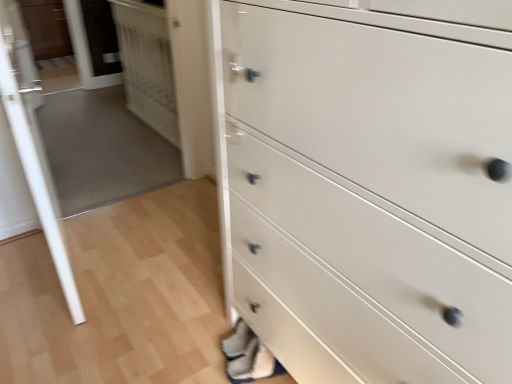
Describe the element at coordinates (104, 101) in the screenshot. I see `transparent glass door at upper left, the 1th glass door from the back` at that location.

This screenshot has height=384, width=512. I want to click on transparent glass door at left, which appears as the 2th glass door when viewed from the back, so click(32, 141).

What do you see at coordinates (147, 65) in the screenshot? The height and width of the screenshot is (384, 512). I see `white glossy door at upper left` at bounding box center [147, 65].

This screenshot has height=384, width=512. Find the location of `transparent glass door at upper left, positioned as the 2th glass door in front-to-back order`. transparent glass door at upper left, positioned as the 2th glass door in front-to-back order is located at coordinates (104, 101).

Between point (6, 44) and point (56, 49), which one is positioned in front?

Positioned in front is point (6, 44).

Consider the image. From a real-world perspective, does transparent glass door at left, which appears as the 2th glass door when viewed from the back, sit lower than matte brown cabinet at upper left?

No.

Considering the positions of objects transparent glass door at left, the first glass door viewed from the front, and matte brown cabinet at upper left in the image provided, who is behind, transparent glass door at left, the first glass door viewed from the front, or matte brown cabinet at upper left?

matte brown cabinet at upper left.

Are transparent glass door at left, which appears as the 2th glass door when viewed from the back, and matte brown cabinet at upper left making contact?

No, transparent glass door at left, which appears as the 2th glass door when viewed from the back, is not with matte brown cabinet at upper left.

From a real-world perspective, is white glossy chest of drawers at lower right on top of matte brown cabinet at upper left?

Yes, from a real-world perspective, white glossy chest of drawers at lower right is over matte brown cabinet at upper left

Can you tell me how much white glossy chest of drawers at lower right and matte brown cabinet at upper left differ in facing direction?

90.5 degrees.

Considering the relative sizes of white glossy chest of drawers at lower right and matte brown cabinet at upper left in the image provided, is white glossy chest of drawers at lower right smaller than matte brown cabinet at upper left?

No.

Considering the sizes of objects white glossy chest of drawers at lower right and matte brown cabinet at upper left in the image provided, who is shorter, white glossy chest of drawers at lower right or matte brown cabinet at upper left?

matte brown cabinet at upper left is shorter.

From the image's perspective, between matte brown cabinet at upper left and white glossy door at upper left, who is located below?

white glossy door at upper left appears lower in the image.

Between matte brown cabinet at upper left and white glossy door at upper left, which one appears on the left side from the viewer's perspective?

matte brown cabinet at upper left.

Is white glossy door at upper left inside matte brown cabinet at upper left?

No, white glossy door at upper left is not a part of matte brown cabinet at upper left.

Is transparent glass door at upper left, the 1th glass door from the back, next to transparent glass door at left, the first glass door viewed from the front, and touching it?

No, transparent glass door at upper left, the 1th glass door from the back, is not beside transparent glass door at left, the first glass door viewed from the front.

Is transparent glass door at upper left, the 1th glass door from the back, positioned in front of transparent glass door at left, the first glass door viewed from the front?

No, transparent glass door at upper left, the 1th glass door from the back, is further to the viewer.

Considering the sizes of transparent glass door at upper left, the 1th glass door from the back, and transparent glass door at left, the first glass door viewed from the front, in the image, is transparent glass door at upper left, the 1th glass door from the back, wider or thinner than transparent glass door at left, the first glass door viewed from the front,?

Considering their sizes, transparent glass door at upper left, the 1th glass door from the back, looks slimmer than transparent glass door at left, the first glass door viewed from the front.

Who is taller, transparent glass door at upper left, the 1th glass door from the back, or transparent glass door at left, which appears as the 2th glass door when viewed from the back?

transparent glass door at left, which appears as the 2th glass door when viewed from the back, is taller.

Consider the image. How much distance is there between white glossy door at upper left and white glossy chest of drawers at lower right?

A distance of 2.02 meters exists between white glossy door at upper left and white glossy chest of drawers at lower right.

Is white glossy door at upper left touching white glossy chest of drawers at lower right?

No, white glossy door at upper left is not beside white glossy chest of drawers at lower right.

From a real-world perspective, is white glossy door at upper left beneath white glossy chest of drawers at lower right?

Yes, from a real-world perspective, white glossy door at upper left is below white glossy chest of drawers at lower right.

What's the angular difference between white glossy door at upper left and white glossy chest of drawers at lower right's facing directions?

There is a 0.478-degree angle between the facing directions of white glossy door at upper left and white glossy chest of drawers at lower right.

Between transparent glass door at left, the first glass door viewed from the front, and white glossy door at upper left, which one is positioned in front?

Positioned in front is transparent glass door at left, the first glass door viewed from the front.

Is transparent glass door at left, which appears as the 2th glass door when viewed from the back, taller than white glossy door at upper left?

Indeed, transparent glass door at left, which appears as the 2th glass door when viewed from the back, has a greater height compared to white glossy door at upper left.

How many degrees apart are the facing directions of transparent glass door at left, which appears as the 2th glass door when viewed from the back, and white glossy door at upper left?

173 degrees separate the facing orientations of transparent glass door at left, which appears as the 2th glass door when viewed from the back, and white glossy door at upper left.

From a real-world perspective, is white glossy chest of drawers at lower right over transparent glass door at upper left, positioned as the 2th glass door in front-to-back order?

Yes.

Which is correct: white glossy chest of drawers at lower right is inside transparent glass door at upper left, the 1th glass door from the back, or outside of it?

white glossy chest of drawers at lower right is located beyond the bounds of transparent glass door at upper left, the 1th glass door from the back.

Is white glossy chest of drawers at lower right looking in the opposite direction of transparent glass door at upper left, positioned as the 2th glass door in front-to-back order?

No, white glossy chest of drawers at lower right is not facing away from transparent glass door at upper left, positioned as the 2th glass door in front-to-back order.

Considering the sizes of objects white glossy chest of drawers at lower right and transparent glass door at upper left, the 1th glass door from the back, in the image provided, who is wider, white glossy chest of drawers at lower right or transparent glass door at upper left, the 1th glass door from the back,?

With larger width is white glossy chest of drawers at lower right.

There is a matte brown cabinet at upper left. At what (x,y) coordinates should I click in order to perform the action: click on the 2nd glass door above it (from a real-world perspective). Please return your answer as a coordinate pair (x, y). Looking at the image, I should click on (32, 141).

Find the location of a particular element. The image size is (512, 384). cabinetry above the white glossy chest of drawers at lower right (from the image's perspective) is located at coordinates (46, 28).

From the picture: From the image, which object appears to be nearer to white glossy chest of drawers at lower right, matte brown cabinet at upper left or transparent glass door at left, which appears as the 2th glass door when viewed from the back?

transparent glass door at left, which appears as the 2th glass door when viewed from the back, is closer to white glossy chest of drawers at lower right.

Considering their positions, is transparent glass door at left, which appears as the 2th glass door when viewed from the back, positioned closer to white glossy door at upper left than white glossy chest of drawers at lower right?

The object closer to white glossy door at upper left is transparent glass door at left, which appears as the 2th glass door when viewed from the back.

When comparing their distances from matte brown cabinet at upper left, does white glossy chest of drawers at lower right or white glossy door at upper left seem further?

Among the two, white glossy chest of drawers at lower right is located further to matte brown cabinet at upper left.

Estimate the real-world distances between objects in this image. Which object is closer to matte brown cabinet at upper left, white glossy chest of drawers at lower right or transparent glass door at left, which appears as the 2th glass door when viewed from the back?

transparent glass door at left, which appears as the 2th glass door when viewed from the back.

Looking at the image, which one is located closer to transparent glass door at left, the first glass door viewed from the front, white glossy chest of drawers at lower right or transparent glass door at upper left, the 1th glass door from the back?

The object closer to transparent glass door at left, the first glass door viewed from the front, is white glossy chest of drawers at lower right.

Based on their spatial positions, is white glossy chest of drawers at lower right or transparent glass door at left, the first glass door viewed from the front, further from transparent glass door at upper left, the 1th glass door from the back?

white glossy chest of drawers at lower right is further to transparent glass door at upper left, the 1th glass door from the back.

Looking at the image, which one is located closer to transparent glass door at left, the first glass door viewed from the front, transparent glass door at upper left, the 1th glass door from the back, or white glossy door at upper left?

white glossy door at upper left.

Which object lies nearer to the anchor point white glossy chest of drawers at lower right, white glossy door at upper left or transparent glass door at upper left, the 1th glass door from the back?

white glossy door at upper left.

Identify the location of door located between transparent glass door at left, which appears as the 2th glass door when viewed from the back, and matte brown cabinet at upper left in the depth direction. This screenshot has height=384, width=512. click(147, 65).

You are a GUI agent. You are given a task and a screenshot of the screen. Output one action in this format:
    pyautogui.click(x=<x>, y=<y>)
    Task: Click on the door located between transparent glass door at upper left, positioned as the 2th glass door in front-to-back order, and matte brown cabinet at upper left in the depth direction
    
    Given the screenshot: What is the action you would take?
    pyautogui.click(x=147, y=65)

What are the coordinates of `glass door located between transparent glass door at left, the first glass door viewed from the front, and white glossy door at upper left in the depth direction` in the screenshot? It's located at (104, 101).

This screenshot has height=384, width=512. I want to click on glass door between transparent glass door at left, which appears as the 2th glass door when viewed from the back, and matte brown cabinet at upper left from front to back, so click(x=104, y=101).